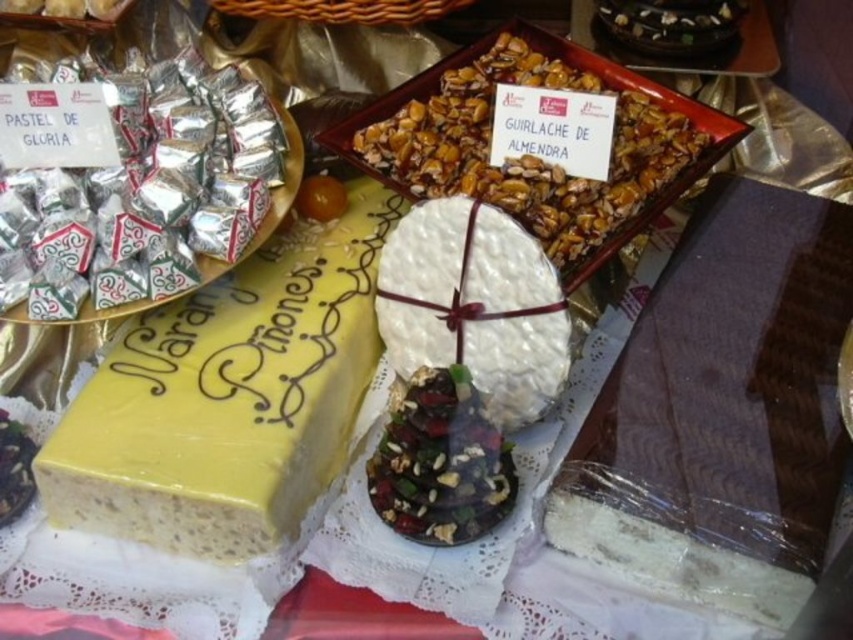
Who is positioned more to the left, shiny almond brittle at center or silver wrapped chocolates at left?

From the viewer's perspective, silver wrapped chocolates at left appears more on the left side.

Does point (596, 198) come behind point (252, 145)?

That is False.

Between point (383, 161) and point (207, 145), which one is positioned behind?

Positioned behind is point (383, 161).

I want to click on shiny almond brittle at center, so click(x=527, y=156).

Is silver wrapped chocolates at left further to the viewer compared to chocolate-covered nuts at center?

That is True.

The image size is (853, 640). Identify the location of silver wrapped chocolates at left. (178, 208).

How far apart are white textured cake at center and chocolate-covered nuts at center?

white textured cake at center is 5.16 inches away from chocolate-covered nuts at center.

This screenshot has width=853, height=640. In order to click on white textured cake at center in this screenshot , I will do [x=474, y=305].

Find the location of `white textured cake at center`. white textured cake at center is located at coordinates (474, 305).